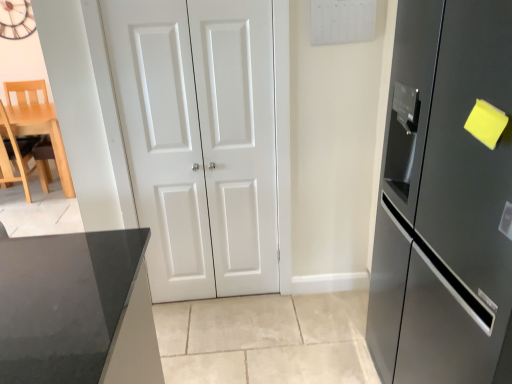
Question: From a real-world perspective, is light wood chair at left above or below white matte door at center, positioned as the first door in right-to-left order?

Choices:
 (A) below
 (B) above

Answer: (A)

Question: Is light wood chair at left in front of or behind white matte door at center, positioned as the first door in right-to-left order, in the image?

Choices:
 (A) behind
 (B) front

Answer: (A)

Question: Which object is positioned closest to the satin black refrigerator at right?

Choices:
 (A) white matte door at center, positioned as the 1th door in left-to-right order
 (B) white matte door at center, positioned as the first door in right-to-left order
 (C) light wood chair at left
 (D) wooden clock at upper left

Answer: (B)

Question: Which object is the closest to the satin black refrigerator at right?

Choices:
 (A) white matte door at center, positioned as the 1th door in left-to-right order
 (B) wooden clock at upper left
 (C) light wood chair at left
 (D) white matte door at center, which is the 2th door in left-to-right order

Answer: (D)